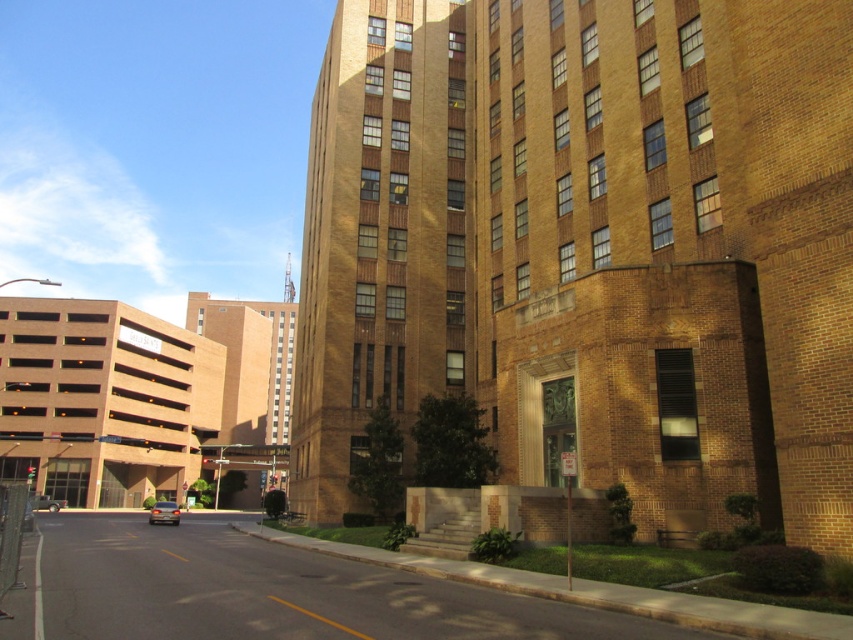
Between shiny silver sedan at center and silver metallic car at lower left, which one appears on the right side from the viewer's perspective?

Positioned to the right is shiny silver sedan at center.

Can you confirm if shiny silver sedan at center is positioned below silver metallic car at lower left?

No, shiny silver sedan at center is not below silver metallic car at lower left.

The width and height of the screenshot is (853, 640). Describe the element at coordinates (164, 513) in the screenshot. I see `shiny silver sedan at center` at that location.

I want to click on shiny silver sedan at center, so click(x=164, y=513).